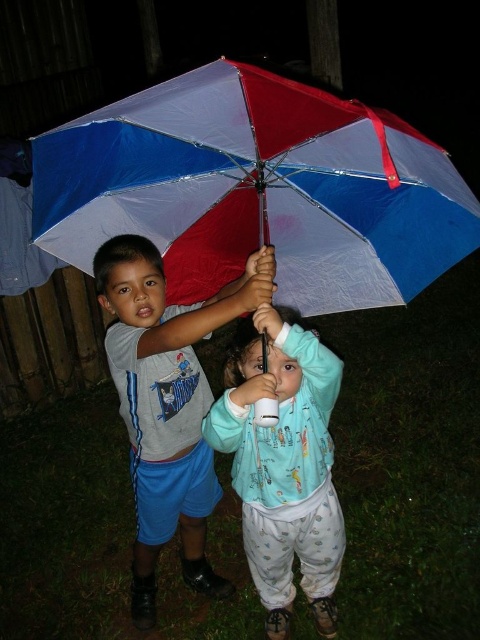
You are a photographer trying to capture the two children under the umbrella. You want to focus on the child closer to the camera. Which point, point (232,104) or point (276,570), should you aim your camera at to ensure the closer child is in focus?

Point (232,104) is closer to the viewer than point (276,570), so you should aim your camera at point (232,104) to focus on the closer child.

You are a photographer trying to capture a photo of the two children under the red and white plastic umbrella at center. To ensure the umbrella stays centered in the frame, where should you position yourself relative to the children?

You should position yourself directly in front of the red and white plastic umbrella at center, aligned with its central point at coordinates approximately 0.297 on the x and 0.535 on the y axis to keep it centered in the frame.